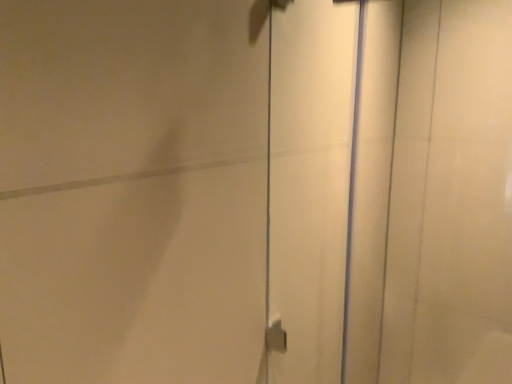
This screenshot has width=512, height=384. I want to click on white glossy screen door at center, so click(x=310, y=183).

In order to face white glossy screen door at center, should I rotate leftwards or rightwards?

You should rotate right by 9.142 degrees.

What do you see at coordinates (310, 183) in the screenshot? The height and width of the screenshot is (384, 512). I see `white glossy screen door at center` at bounding box center [310, 183].

I want to click on white glossy screen door at center, so tap(310, 183).